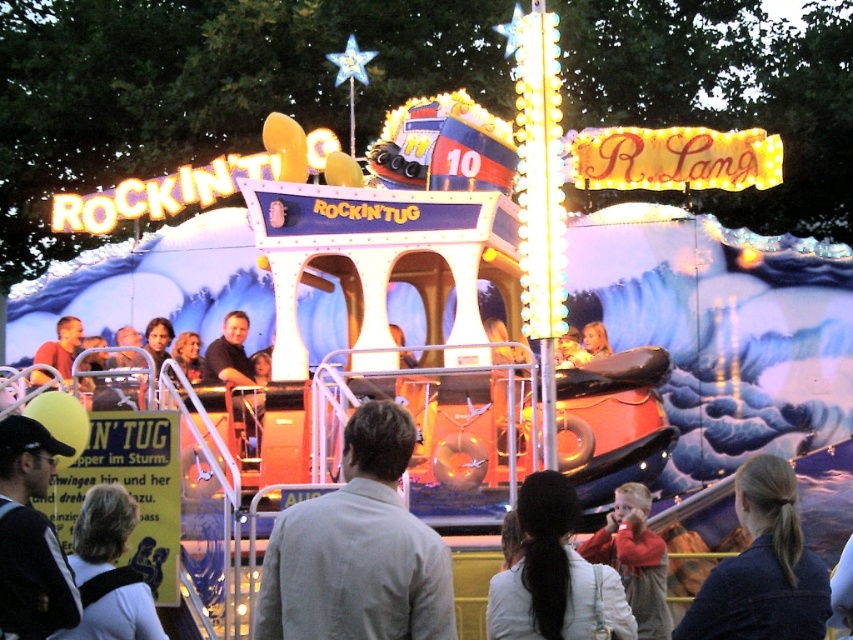
Question: Is gray cotton shirt at center wider than matte black shirt at center?

Choices:
 (A) no
 (B) yes

Answer: (B)

Question: Which object is closer to the camera taking this photo?

Choices:
 (A) light brown hair at lower left
 (B) white fabric ponytail at lower center

Answer: (B)

Question: Observing the image, what is the correct spatial positioning of light brown hair at lower left in reference to matte black shirt at center?

Choices:
 (A) below
 (B) above

Answer: (A)

Question: Can you confirm if red fleece jacket at lower right is positioned to the left of matte black shirt at center?

Choices:
 (A) yes
 (B) no

Answer: (B)

Question: Which object appears farthest from the camera in this image?

Choices:
 (A) matte brown shirt at center
 (B) light brown hair at lower left
 (C) dark blue hair at lower right

Answer: (A)

Question: Based on their relative distances, which object is farther from the red fleece jacket at lower right?

Choices:
 (A) light brown hair at lower left
 (B) black leather jacket at lower left

Answer: (B)